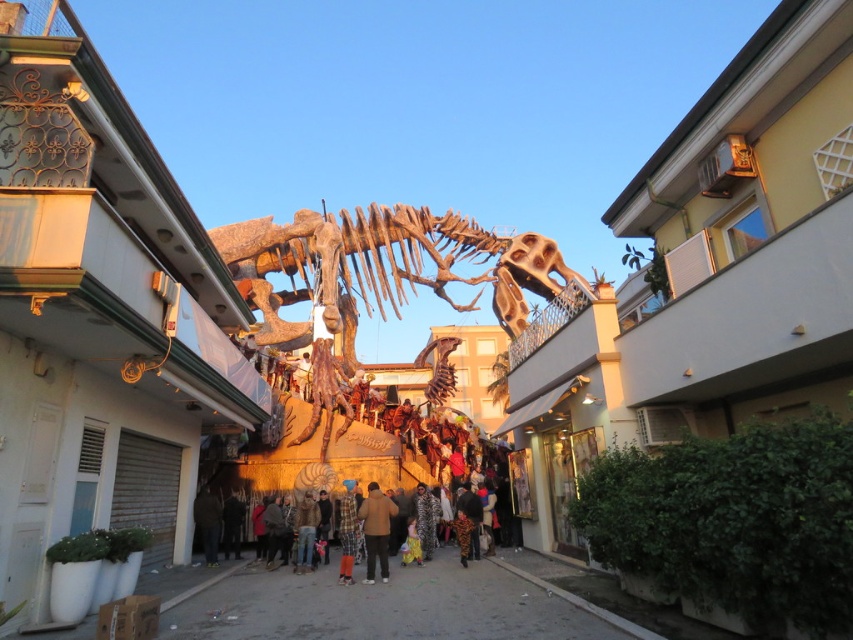
Who is positioned more to the right, brown fabric pants at center or camouflage-patterned pants at center?

camouflage-patterned pants at center

Image resolution: width=853 pixels, height=640 pixels. Describe the element at coordinates (376, 529) in the screenshot. I see `brown fabric pants at center` at that location.

Is point (366, 545) closer to camera compared to point (471, 541)?

Yes, point (366, 545) is in front of point (471, 541).

Locate an element on the screen. Image resolution: width=853 pixels, height=640 pixels. brown fabric pants at center is located at coordinates (376, 529).

Who is higher up, dark brown fabric at lower center or flannel shirt at center?

Positioned higher is flannel shirt at center.

Which of these two, dark brown fabric at lower center or flannel shirt at center, stands taller?

With more height is dark brown fabric at lower center.

Does point (207, 512) lie behind point (343, 573)?

Yes, it is.

Locate an element on the screen. Image resolution: width=853 pixels, height=640 pixels. dark brown fabric at lower center is located at coordinates (207, 522).

Is camouflage-patterned jacket at center positioned before camouflage-patterned pants at center?

No, it is behind camouflage-patterned pants at center.

Where is `camouflage-patterned jacket at center`? This screenshot has width=853, height=640. camouflage-patterned jacket at center is located at coordinates (254, 481).

Identify the location of camouflage-patterned jacket at center. click(x=254, y=481).